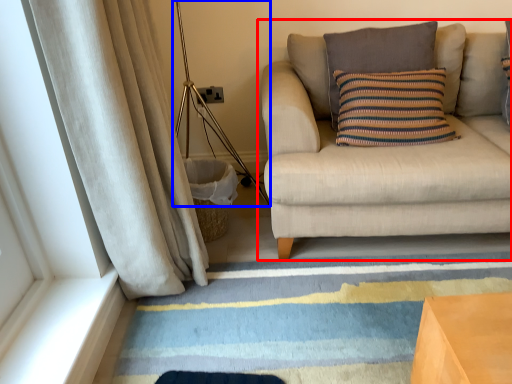
Question: Among these objects, which one is farthest to the camera, studio couch (highlighted by a red box) or lamp (highlighted by a blue box)?

Choices:
 (A) studio couch
 (B) lamp

Answer: (B)